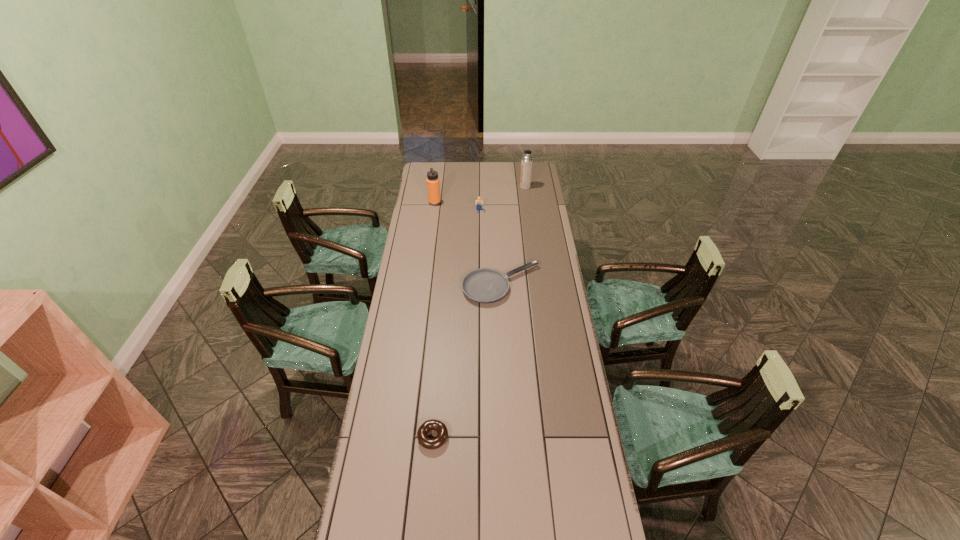
Locate an element on the screen. Image resolution: width=960 pixels, height=540 pixels. the farthest object is located at coordinates (527, 161).

Where is `the right thermos bottle`? The image size is (960, 540). the right thermos bottle is located at coordinates (527, 161).

At what (x,y) coordinates should I click in order to perform the action: click on the leftmost object. Please return your answer as a coordinate pair (x, y). This screenshot has height=540, width=960. Looking at the image, I should click on (433, 185).

Where is `the nearer thermos bottle`? This screenshot has width=960, height=540. the nearer thermos bottle is located at coordinates (433, 185).

Image resolution: width=960 pixels, height=540 pixels. Find the location of `the third shortest object`. the third shortest object is located at coordinates (478, 203).

In order to click on Lego in this screenshot , I will do `click(478, 203)`.

I want to click on the nearest object, so click(429, 443).

Identify the location of doughnut. Image resolution: width=960 pixels, height=540 pixels. (429, 443).

Find the location of a particular element. The width and height of the screenshot is (960, 540). frying pan is located at coordinates (485, 285).

You are a GUI agent. You are given a task and a screenshot of the screen. Output one action in this format:
    pyautogui.click(x=<x>, y=<y>)
    Task: Click on the free space located 0.320m on the front of the farther thermos bottle
    
    Given the screenshot: What is the action you would take?
    pyautogui.click(x=530, y=222)